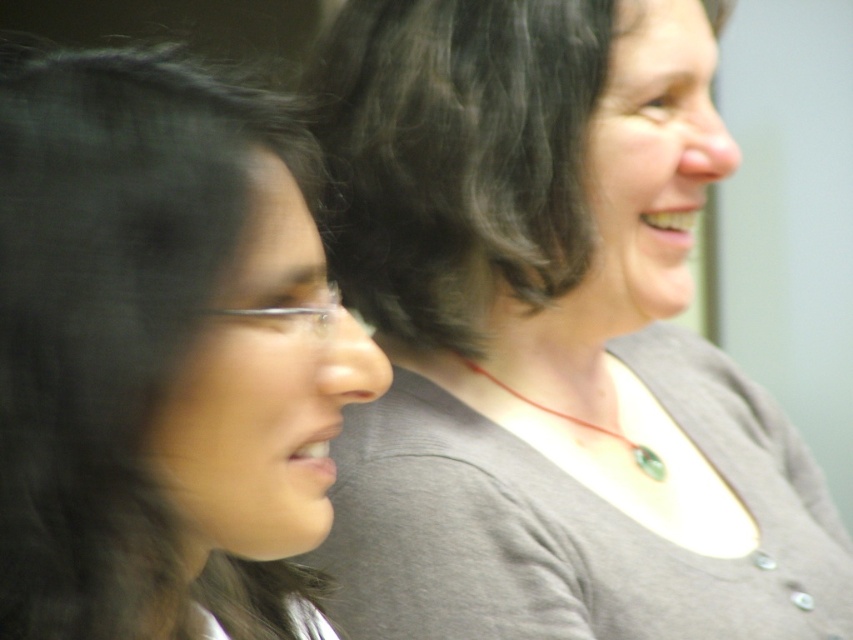
Question: Is gray matte necklace at center further to camera compared to green gemstone necklace at center?

Choices:
 (A) no
 (B) yes

Answer: (A)

Question: Considering the real-world distances, which object is farthest from the gray matte shirt at center?

Choices:
 (A) green gemstone necklace at center
 (B) black hair at left
 (C) dark brown curly hair at upper center
 (D) gray matte necklace at center

Answer: (B)

Question: Which of the following is the farthest from the observer?

Choices:
 (A) (x=821, y=557)
 (B) (x=515, y=396)
 (C) (x=479, y=16)
 (D) (x=334, y=192)

Answer: (A)

Question: Which of these objects is positioned closest to the dark brown curly hair at upper center?

Choices:
 (A) gray matte shirt at center
 (B) black hair at left
 (C) gray matte necklace at center
 (D) green gemstone necklace at center

Answer: (A)

Question: Is gray matte shirt at center further to camera compared to black hair at left?

Choices:
 (A) yes
 (B) no

Answer: (A)

Question: Can you confirm if gray matte necklace at center is positioned above green gemstone necklace at center?

Choices:
 (A) yes
 (B) no

Answer: (B)